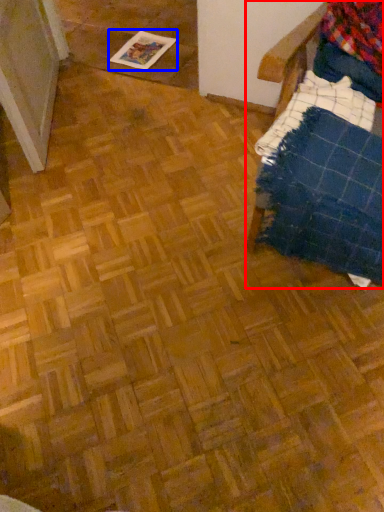
Question: Which object is further to the camera taking this photo, furniture (highlighted by a red box) or magazine (highlighted by a blue box)?

Choices:
 (A) furniture
 (B) magazine

Answer: (B)